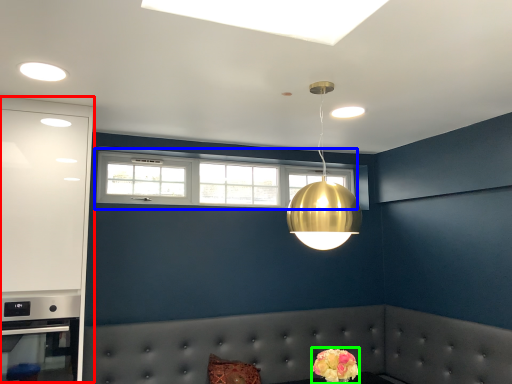
Question: Considering the real-world distances, which object is farthest from dresser (highlighted by a red box)? window (highlighted by a blue box) or flower (highlighted by a green box)?

Choices:
 (A) window
 (B) flower

Answer: (B)